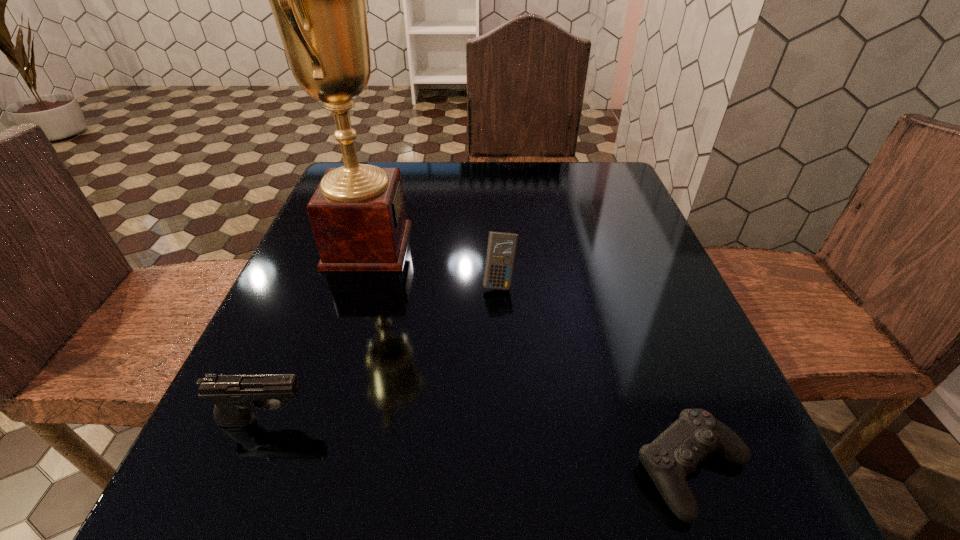
Where is `empty location between the calculator and the rightmost object`? The width and height of the screenshot is (960, 540). empty location between the calculator and the rightmost object is located at coordinates (596, 376).

Identify which object is the closest to the calculator. Please provide its 2D coordinates. Your answer should be formatted as a tuple, i.e. [(x, y)], where the tuple contains the x and y coordinates of a point satisfying the conditions above.

[(357, 213)]

Find the location of a particular element. The image size is (960, 540). object that can be found as the third closest to the tallest object is located at coordinates (675, 453).

What are the coordinates of `vacant space that satisfies the following two spatial constraints: 1. on the front-facing side of the second object from right to left; 2. on the right side of the rightmost object` in the screenshot? It's located at (509, 469).

What are the coordinates of `vacant space that satisfies the following two spatial constraints: 1. on the plaque of the tallest object; 2. on the back side of the shortest object` in the screenshot? It's located at (297, 469).

The width and height of the screenshot is (960, 540). I want to click on vacant space that satisfies the following two spatial constraints: 1. on the front-facing side of the rightmost object; 2. on the left side of the second object from right to left, so click(x=509, y=469).

You are a GUI agent. You are given a task and a screenshot of the screen. Output one action in this format:
    pyautogui.click(x=<x>, y=<y>)
    Task: Click on the free space that satisfies the following two spatial constraints: 1. on the plaque of the control; 2. on the left side of the trophy cup
    Image resolution: width=960 pixels, height=540 pixels.
    Given the screenshot: What is the action you would take?
    [x=297, y=469]

You are a GUI agent. You are given a task and a screenshot of the screen. Output one action in this format:
    pyautogui.click(x=<x>, y=<y>)
    Task: Click on the vacant space that satisfies the following two spatial constraints: 1. at the barrel of the rightmost object; 2. on the left side of the pistol
    This screenshot has width=960, height=540.
    Given the screenshot: What is the action you would take?
    pyautogui.click(x=246, y=469)